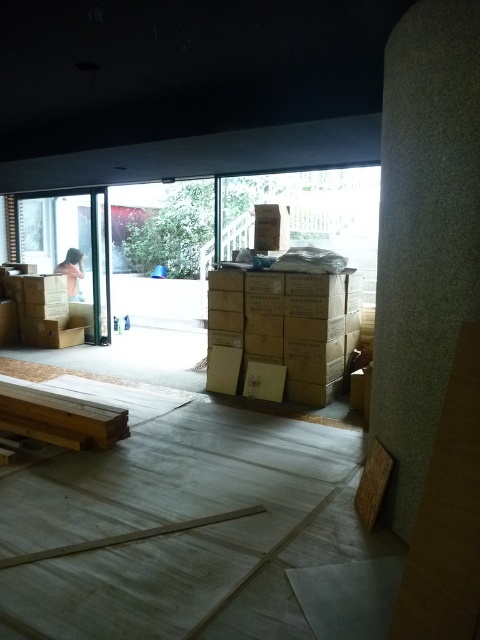
You are a delivery person who needs to place a new matte brown cardboard box at center exactly 5 meters away from the transparent glass door at left. Can you place it in the current scene as described?

The transparent glass door at left is currently 4.57 meters away from the matte brown cardboard box at center, so placing the new box exactly 5 meters away would require moving it slightly further away from the door.

You are a delivery person carrying a package that requires a signature from the homeowner. The homeowner is currently outside the transparent glass door at left. You need to reach them without entering the construction area. Can you reach them from your current position?

The transparent glass door at left is 8.75 meters away from the viewer. Since the homeowner is outside the door, you can reach them without entering the construction area by approaching the transparent glass door at left from your current position.